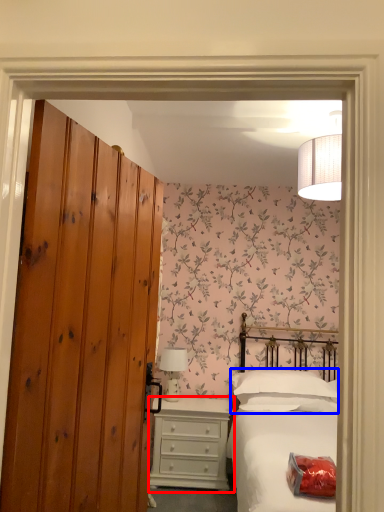
Question: Which object is closer to the camera taking this photo, chest of drawers (highlighted by a red box) or pillow (highlighted by a blue box)?

Choices:
 (A) chest of drawers
 (B) pillow

Answer: (B)